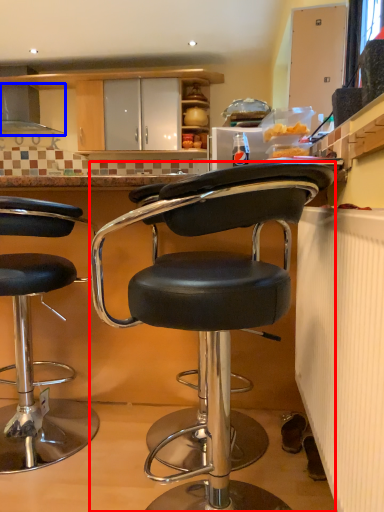
Question: Which point is further to the camera, chair (highlighted by a red box) or exhaust hood (highlighted by a blue box)?

Choices:
 (A) chair
 (B) exhaust hood

Answer: (B)